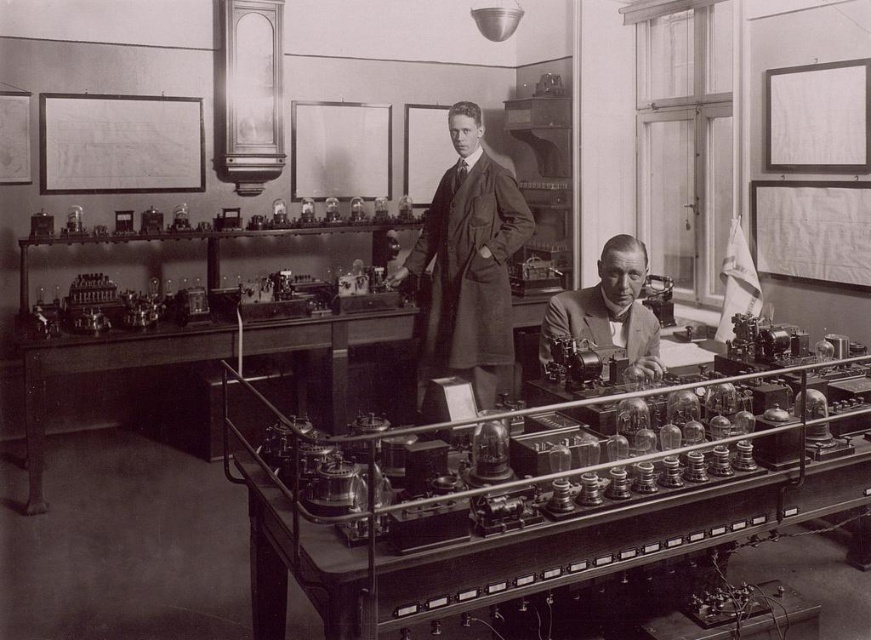
Question: Which point appears farthest from the camera in this image?

Choices:
 (A) (640, 250)
 (B) (440, 273)

Answer: (B)

Question: Among these points, which one is farthest from the camera?

Choices:
 (A) (473, 246)
 (B) (346, 570)
 (C) (643, 353)

Answer: (A)

Question: Which object is closer to the camera taking this photo?

Choices:
 (A) metallic glass tubes at center
 (B) matte dark brown suit at center

Answer: (A)

Question: Is metallic glass tubes at center wider than matte dark brown suit at center?

Choices:
 (A) no
 (B) yes

Answer: (B)

Question: In this image, where is matte dark brown suit at center located relative to light brown suit at center?

Choices:
 (A) above
 (B) below

Answer: (A)

Question: From the image, what is the correct spatial relationship of matte dark brown suit at center in relation to light brown suit at center?

Choices:
 (A) right
 (B) left

Answer: (B)